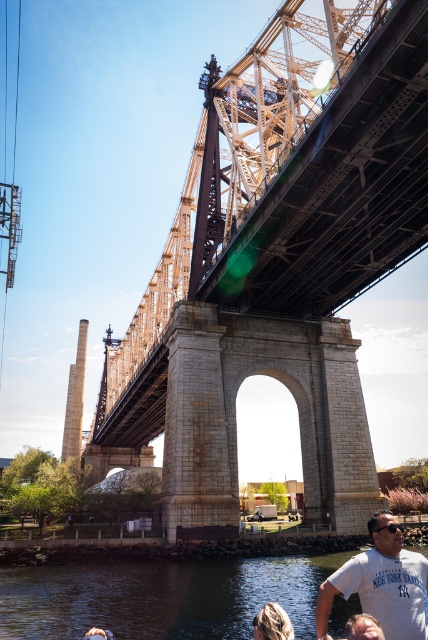
You are a photographer planning to take a picture of the rusty metal bridge at center and the clear water at lower center. Which object should you focus on first if you want to capture both in a single frame without moving the camera?

The rusty metal bridge at center is much taller than the clear water at lower center, so you should focus on the rusty metal bridge at center first to ensure it is in sharp focus before adjusting for the clear water at lower center.